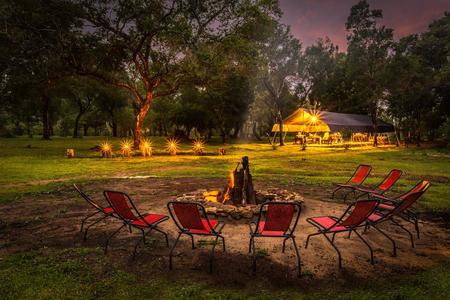
Find the location of a particular element. The width and height of the screenshot is (450, 300). red chair is located at coordinates (147, 220).